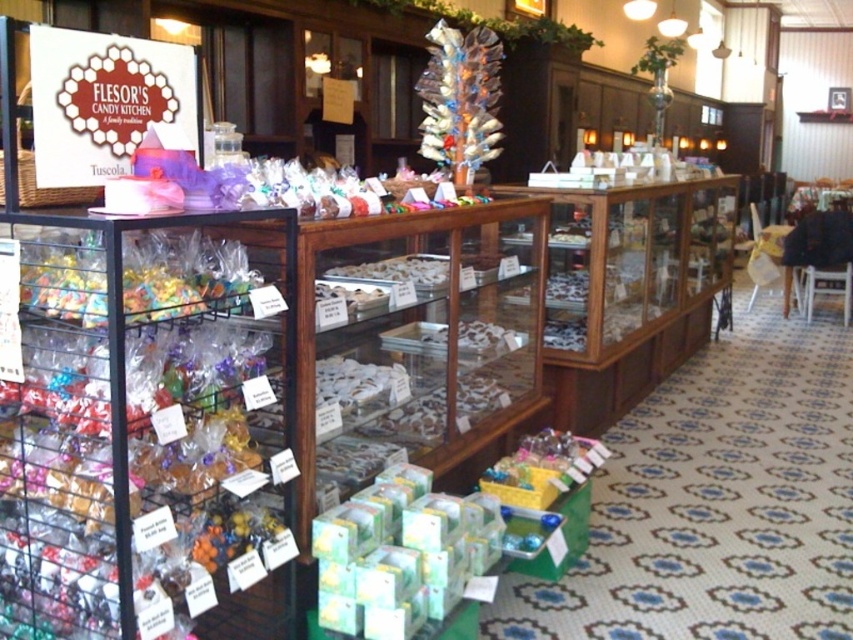
Question: In this image, where is translucent plastic candy at upper center located relative to white glossy chocolate at center?

Choices:
 (A) left
 (B) right

Answer: (A)

Question: Where is translucent plastic candy at upper center located in relation to white glossy chocolate at center in the image?

Choices:
 (A) above
 (B) below

Answer: (A)

Question: Is translucent plastic candy at upper center below white glossy chocolate at center?

Choices:
 (A) no
 (B) yes

Answer: (A)

Question: Which of the following is the closest to the observer?

Choices:
 (A) translucent plastic candy at upper center
 (B) white glossy chocolate at center

Answer: (B)